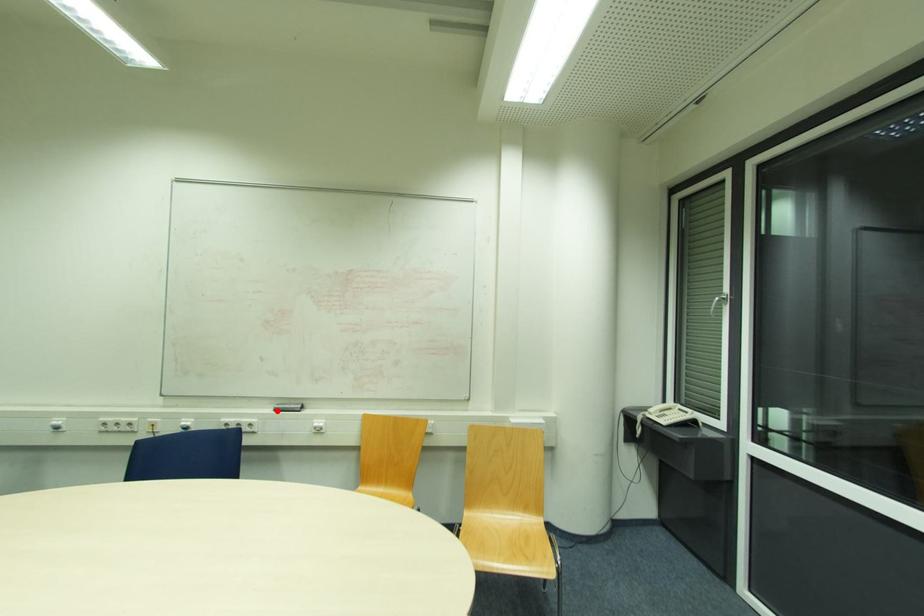
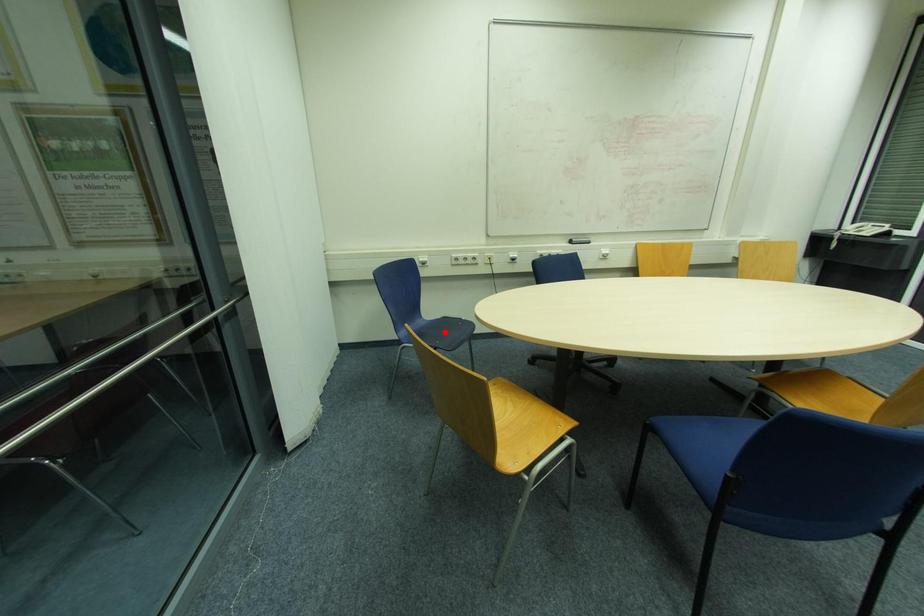
I am providing you with two images of the same scene from different viewpoints. A red point is marked on the first image and another point is marked on the second image. Is the red point in image1 aligned with the point shown in image2?

No